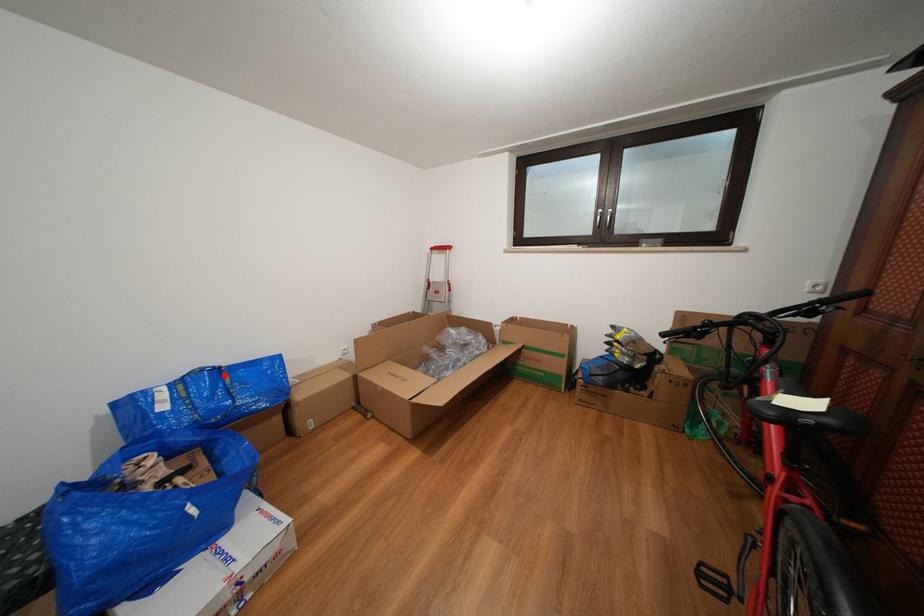
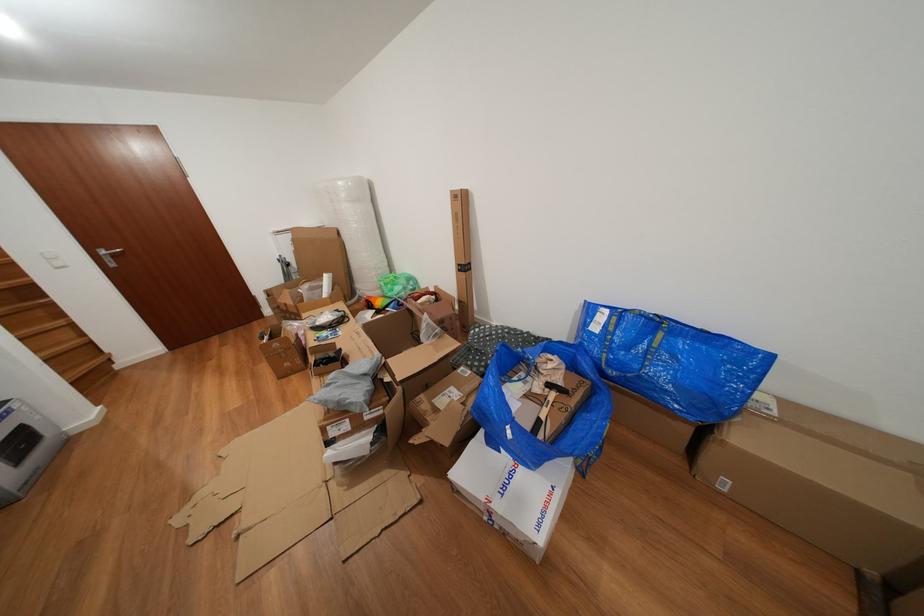
Find the pixel in the second image that matches the highlighted location in the first image.

(663, 328)